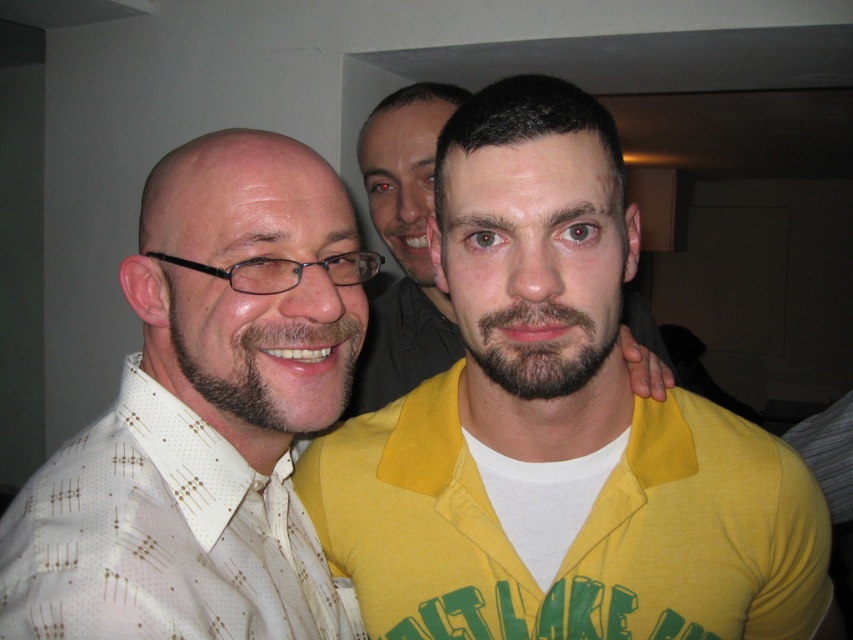
Who is positioned more to the right, yellow matte shirt at center or matte yellow shirt at center?

Positioned to the right is yellow matte shirt at center.

Is yellow matte shirt at center shorter than matte yellow shirt at center?

Yes.

Find the location of a particular element. yellow matte shirt at center is located at coordinates (558, 429).

Consider the image. Does white dotted fabric shirt at left have a lesser height compared to brownsoftbeard at left?

No.

Is white dotted fabric shirt at left bigger than brownsoftbeard at left?

Indeed, white dotted fabric shirt at left has a larger size compared to brownsoftbeard at left.

You are a GUI agent. You are given a task and a screenshot of the screen. Output one action in this format:
    pyautogui.click(x=<x>, y=<y>)
    Task: Click on the white dotted fabric shirt at left
    The height and width of the screenshot is (640, 853).
    Given the screenshot: What is the action you would take?
    pyautogui.click(x=163, y=538)

Does matte yellow shirt at center have a lesser width compared to dark brown fuzzy beard at center?

In fact, matte yellow shirt at center might be wider than dark brown fuzzy beard at center.

Based on the photo, can you confirm if matte yellow shirt at center is positioned to the right of dark brown fuzzy beard at center?

In fact, matte yellow shirt at center is to the left of dark brown fuzzy beard at center.

Is point (416, 204) more distant than point (584, 321)?

Yes, it is behind point (584, 321).

At what (x,y) coordinates should I click in order to perform the action: click on matte yellow shirt at center. Please return your answer as a coordinate pair (x, y). Looking at the image, I should click on (404, 246).